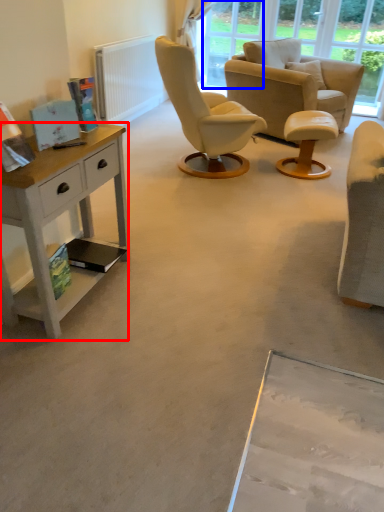
Question: Which object appears closest to the camera in this image, desk (highlighted by a red box) or window screen (highlighted by a blue box)?

Choices:
 (A) desk
 (B) window screen

Answer: (A)